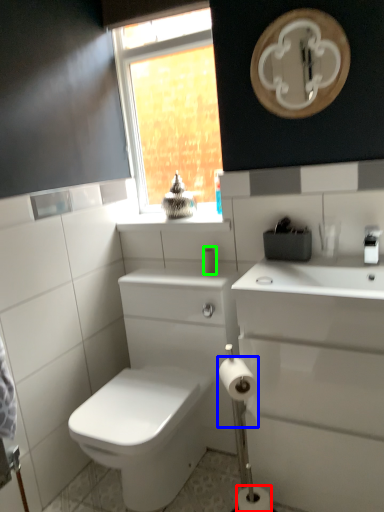
Question: Which is farther away from toilet paper (highlighted by a red box)? toilet paper (highlighted by a blue box) or toiletry (highlighted by a green box)?

Choices:
 (A) toilet paper
 (B) toiletry

Answer: (B)